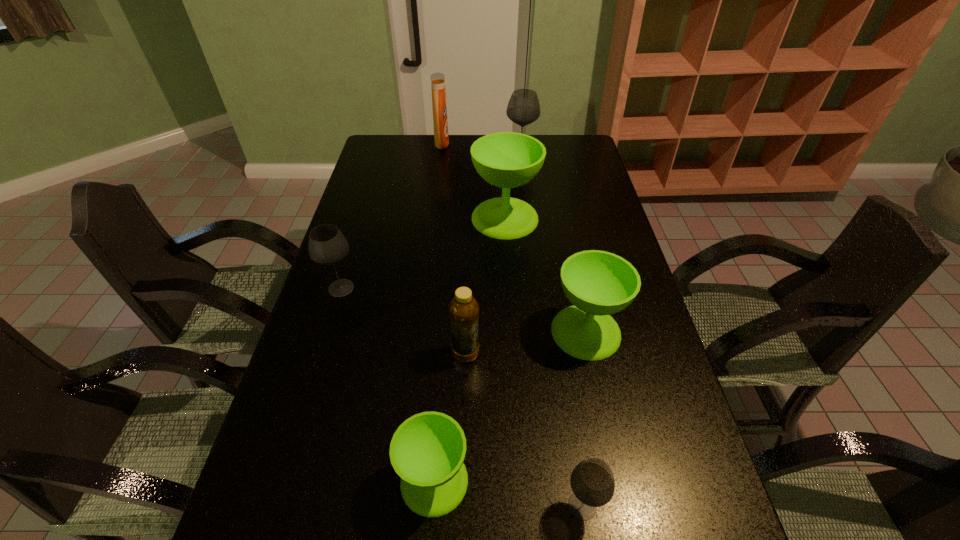
Locate which gray wineglass ranks second in proximity to the detergent. Please provide its 2D coordinates. Your answer should be formatted as a tuple, i.e. [(x, y)], where the tuple contains the x and y coordinates of a point satisfying the conditions above.

[(327, 245)]

The height and width of the screenshot is (540, 960). Find the location of `green wineglass object that ranks as the closest to the smallest green wineglass`. green wineglass object that ranks as the closest to the smallest green wineglass is located at coordinates (598, 283).

Choose which green wineglass is the second nearest neighbor to the nearest green wineglass. Please provide its 2D coordinates. Your answer should be formatted as a tuple, i.e. [(x, y)], where the tuple contains the x and y coordinates of a point satisfying the conditions above.

[(506, 159)]

Where is `free space that satisfies the following two spatial constraints: 1. on the front-facing side of the detergent; 2. on the back side of the nearest gray wineglass`? This screenshot has width=960, height=540. free space that satisfies the following two spatial constraints: 1. on the front-facing side of the detergent; 2. on the back side of the nearest gray wineglass is located at coordinates (397, 505).

Identify the location of vacant region that satisfies the following two spatial constraints: 1. on the back side of the biggest gray wineglass; 2. on the left side of the second biggest gray wineglass. The width and height of the screenshot is (960, 540). 382,156.

Identify the location of vacant space that satisfies the following two spatial constraints: 1. on the back side of the bottle; 2. on the right side of the biggest green wineglass. (469, 218).

Identify the location of free space that satisfies the following two spatial constraints: 1. on the front side of the fifth nearest object; 2. on the right side of the bottle. (321, 354).

The image size is (960, 540). I want to click on free spot that satisfies the following two spatial constraints: 1. on the front side of the farthest wineglass; 2. on the right side of the third nearest wineglass, so click(x=542, y=332).

Locate an element on the screen. Image resolution: width=960 pixels, height=540 pixels. vacant region that satisfies the following two spatial constraints: 1. on the front-facing side of the detergent; 2. on the left side of the farthest gray wineglass is located at coordinates (441, 156).